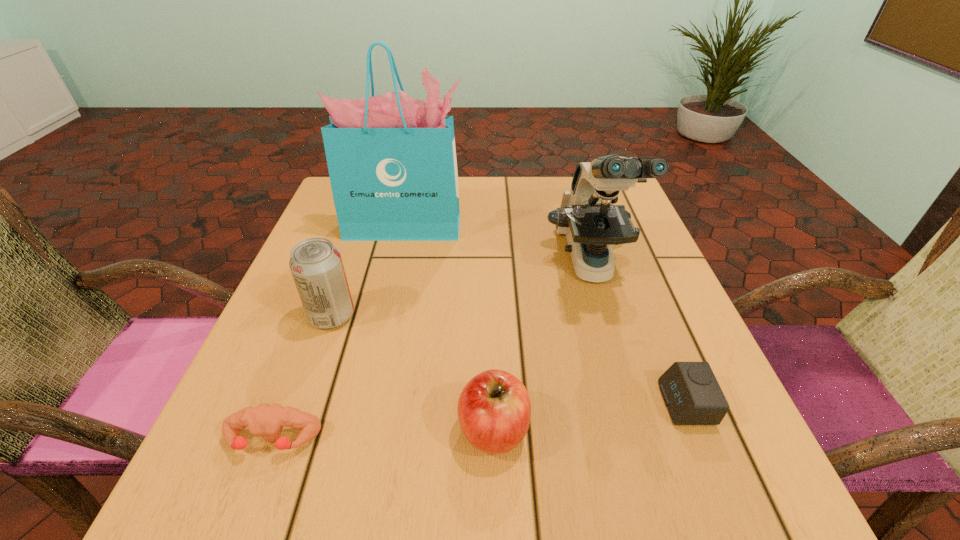
The width and height of the screenshot is (960, 540). Identify the location of vacant area that lies between the puncher and the soda can. (302, 377).

Where is `vacant area between the third tallest object and the fifth shortest object`? vacant area between the third tallest object and the fifth shortest object is located at coordinates (461, 291).

Identify the location of vacant area that lies between the tallest object and the puncher. The width and height of the screenshot is (960, 540). (339, 333).

At what (x,y) coordinates should I click in order to perform the action: click on vacant region between the fourth tallest object and the fourth shortest object. Please return your answer as a coordinate pair (x, y). Looking at the image, I should click on (413, 373).

At what (x,y) coordinates should I click in order to perform the action: click on free spot between the alarm clock and the tallest object. Please return your answer as a coordinate pair (x, y). This screenshot has width=960, height=540. Looking at the image, I should click on (545, 315).

This screenshot has height=540, width=960. In order to click on unoccupied position between the tallest object and the second tallest object in this screenshot , I will do `click(498, 246)`.

Image resolution: width=960 pixels, height=540 pixels. I want to click on vacant space that's between the puncher and the fourth shortest object, so click(302, 377).

Where is `object that is the fifth closest to the shopping bag`? The width and height of the screenshot is (960, 540). object that is the fifth closest to the shopping bag is located at coordinates 691,392.

Select which object appears as the closest to the soda can. Please provide its 2D coordinates. Your answer should be formatted as a tuple, i.e. [(x, y)], where the tuple contains the x and y coordinates of a point satisfying the conditions above.

[(267, 420)]